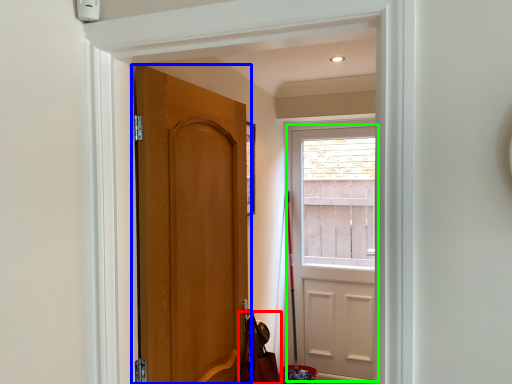
Question: Which is farther away from shoulder bag (highlighted by a red box)? door (highlighted by a blue box) or door (highlighted by a green box)?

Choices:
 (A) door
 (B) door

Answer: (B)